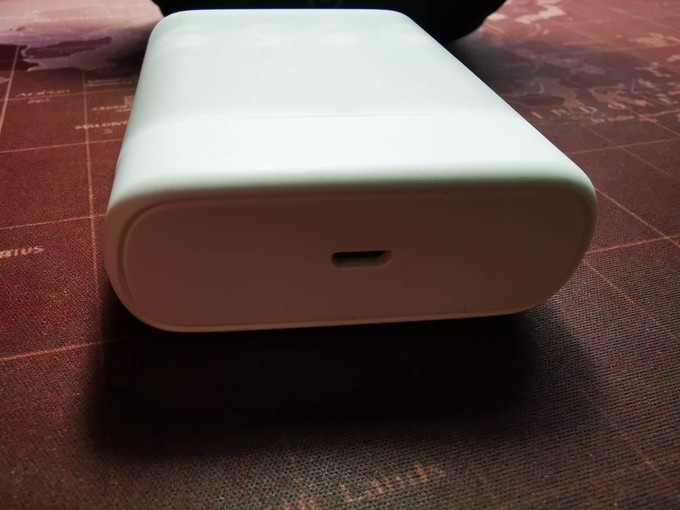
Locate an element on the screen. This screenshot has height=510, width=680. surface is located at coordinates (401, 464).